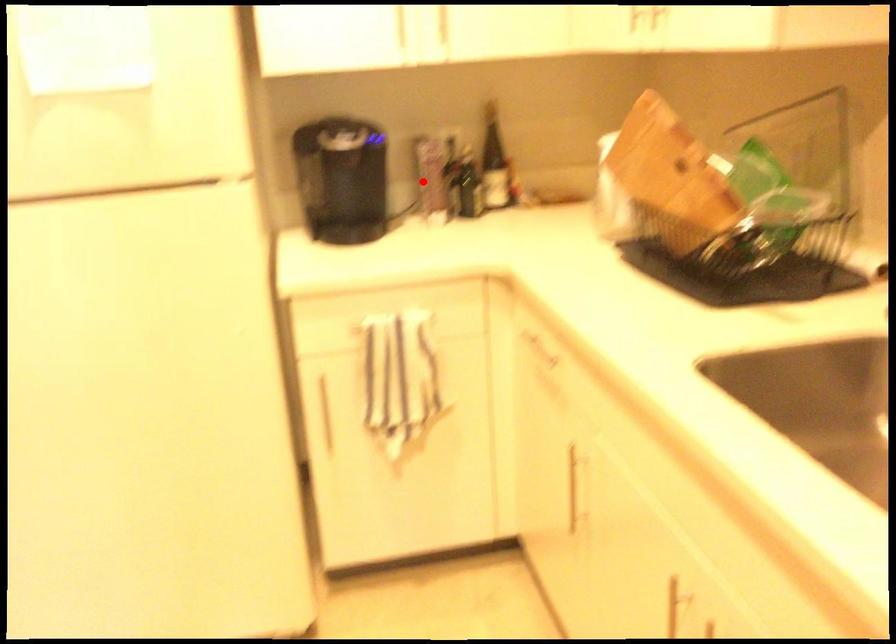
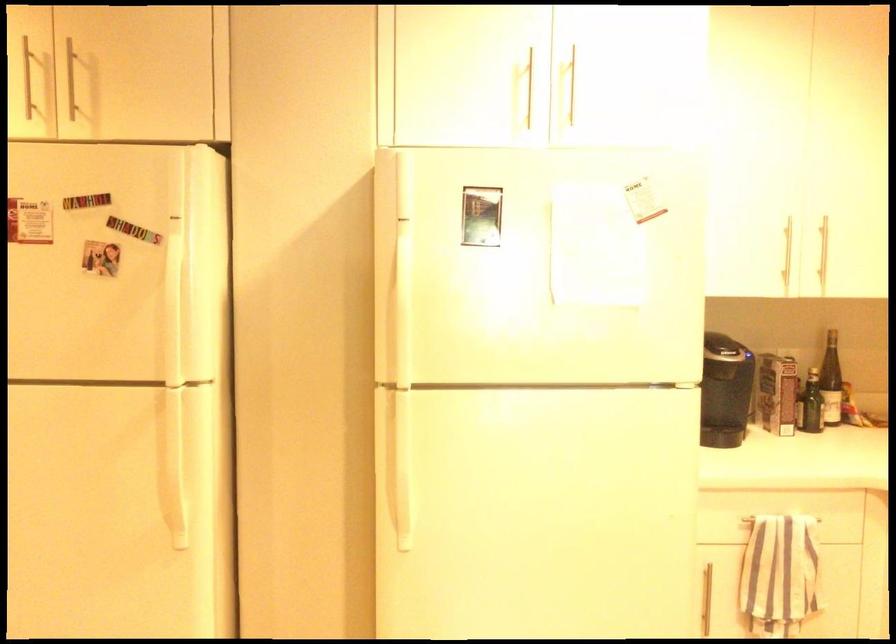
In the second image, find the point that corresponds to the highlighted location in the first image.

(777, 393)